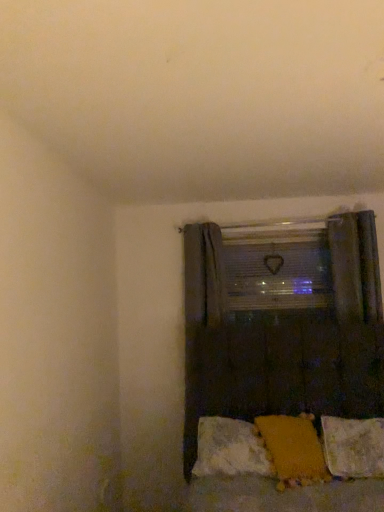
Question: Does point (319, 265) appear closer or farther from the camera than point (342, 463)?

Choices:
 (A) closer
 (B) farther

Answer: (B)

Question: Is clear plastic window screen at center spatially inside fluffy white pillow at lower right, the 3th pillow when ordered from left to right, or outside of it?

Choices:
 (A) inside
 (B) outside

Answer: (B)

Question: Estimate the real-world distances between objects in this image. Which object is farther from the fluffy white pillow at lower right, the 3th pillow when ordered from left to right?

Choices:
 (A) yellow fabric pillow at lower center, which ranks as the 2th pillow in left-to-right order
 (B) clear plastic window screen at center
 (C) orange fabric pillow at lower center, which is counted as the first pillow, starting from the left

Answer: (B)

Question: Estimate the real-world distances between objects in this image. Which object is closer to the fluffy white pillow at lower right, the 3th pillow when ordered from left to right?

Choices:
 (A) yellow fabric pillow at lower center, which ranks as the 2th pillow in left-to-right order
 (B) orange fabric pillow at lower center, the third pillow from the right
 (C) clear plastic window screen at center

Answer: (A)